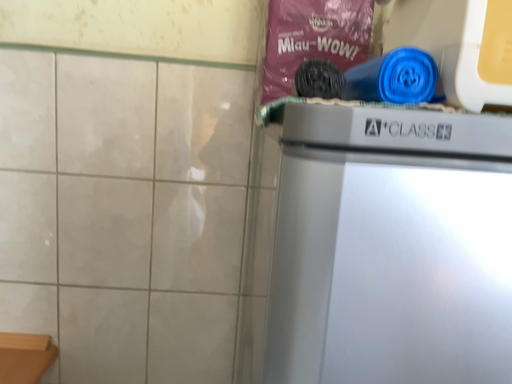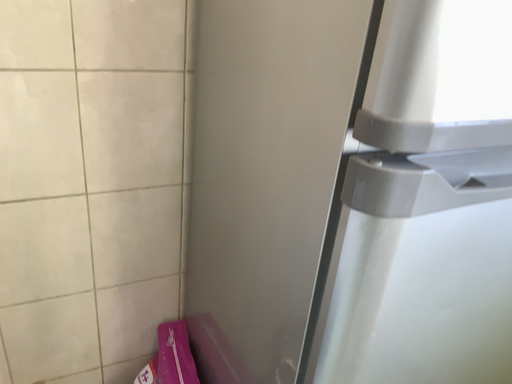
Question: How did the camera likely rotate when shooting the video?

Choices:
 (A) rotated right
 (B) rotated left

Answer: (A)